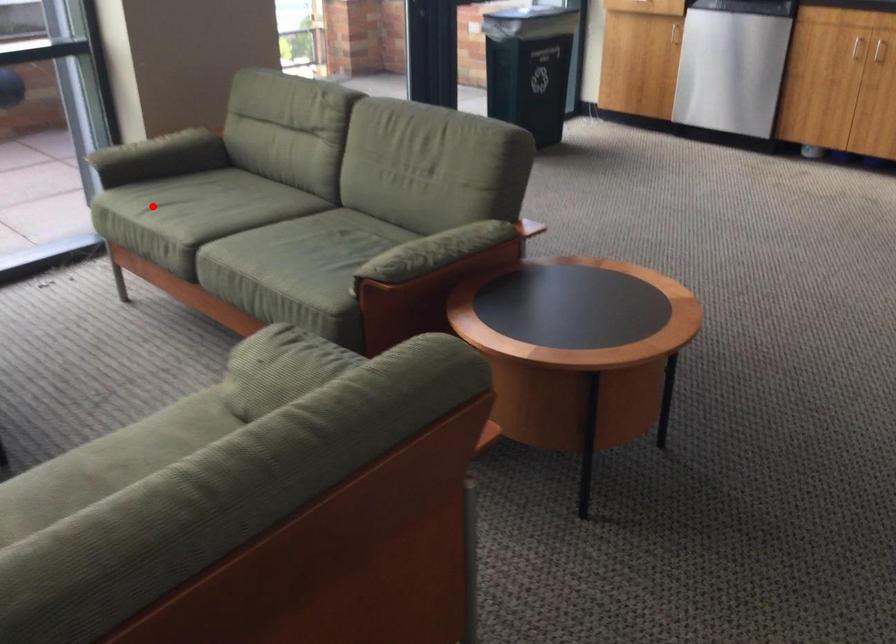
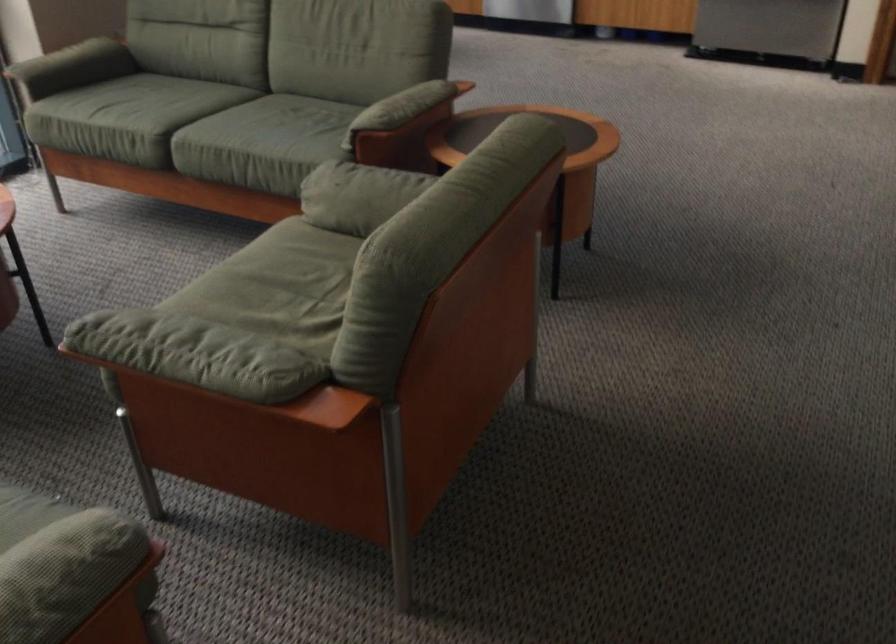
Where in the second image is the point corresponding to the highlighted location from the first image?

(97, 108)